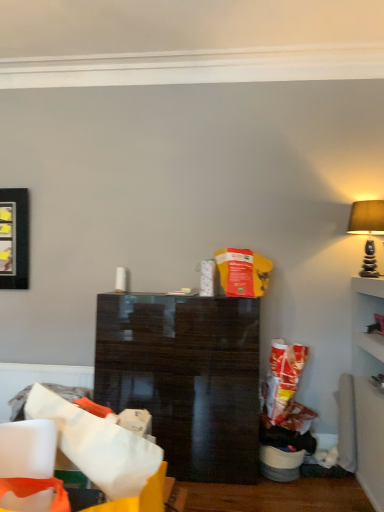
What is the approximate width of matte black picture frame at left?

matte black picture frame at left is 4.18 inches wide.

Measure the distance between matte black picture frame at left and camera.

The depth of matte black picture frame at left is 3.62 meters.

The image size is (384, 512). In order to click on glossy dark wood cabinet at center in this screenshot , I will do `click(185, 378)`.

The height and width of the screenshot is (512, 384). Find the location of `white paper bag at lower left`. white paper bag at lower left is located at coordinates (94, 442).

Is matte beige lampshade at upper right with matte black picture frame at left?

No, matte beige lampshade at upper right is not making contact with matte black picture frame at left.

Where is `picture frame behind the matte beige lampshade at upper right`? The image size is (384, 512). picture frame behind the matte beige lampshade at upper right is located at coordinates (14, 238).

Which is behind, matte beige lampshade at upper right or matte black picture frame at left?

matte black picture frame at left is further away from the camera.

Which is less distant, (153, 382) or (370, 209)?

Clearly, point (153, 382) is closer to the camera than point (370, 209).

Could you tell me if glossy dark wood cabinet at center is turned towards matte beige lampshade at upper right?

No, glossy dark wood cabinet at center is not aimed at matte beige lampshade at upper right.

The image size is (384, 512). In the image, there is a matte beige lampshade at upper right. In order to click on shelf below it (from the image's perspective) in this screenshot , I will do `click(185, 378)`.

Consider the image. Can you confirm if glossy dark wood cabinet at center is positioned to the right of matte beige lampshade at upper right?

In fact, glossy dark wood cabinet at center is to the left of matte beige lampshade at upper right.

Considering the relative positions of matte black picture frame at left and white paper bag at lower left in the image provided, is matte black picture frame at left to the left of white paper bag at lower left from the viewer's perspective?

Correct, you'll find matte black picture frame at left to the left of white paper bag at lower left.

Which of these two, matte black picture frame at left or white paper bag at lower left, stands taller?

matte black picture frame at left.

Who is smaller, matte black picture frame at left or white paper bag at lower left?

Smaller between the two is matte black picture frame at left.

Is matte black picture frame at left positioned beyond the bounds of white paper bag at lower left?

Yes.

Is white paper bag at lower left in front of or behind glossy dark wood cabinet at center in the image?

In the image, white paper bag at lower left appears in front of glossy dark wood cabinet at center.

Who is bigger, white paper bag at lower left or glossy dark wood cabinet at center?

With larger size is glossy dark wood cabinet at center.

Is white paper bag at lower left facing away from glossy dark wood cabinet at center?

No, white paper bag at lower left is not facing the opposite direction of glossy dark wood cabinet at center.

Is there a large distance between white paper bag at lower left and glossy dark wood cabinet at center?

That's right, there is a large distance between white paper bag at lower left and glossy dark wood cabinet at center.

Does white paper bag at lower left touch matte beige lampshade at upper right?

white paper bag at lower left and matte beige lampshade at upper right are clearly separated.

Between white paper bag at lower left and matte beige lampshade at upper right, which one has smaller size?

With smaller size is matte beige lampshade at upper right.

Where is `picture frame that is behind the glossy dark wood cabinet at center`? picture frame that is behind the glossy dark wood cabinet at center is located at coordinates (14, 238).

Is matte black picture frame at left situated inside glossy dark wood cabinet at center or outside?

matte black picture frame at left cannot be found inside glossy dark wood cabinet at center.

In the scene shown: Considering the positions of objects matte black picture frame at left and glossy dark wood cabinet at center in the image provided, who is more to the right, matte black picture frame at left or glossy dark wood cabinet at center?

From the viewer's perspective, glossy dark wood cabinet at center appears more on the right side.

Is matte black picture frame at left wider than glossy dark wood cabinet at center?

No, matte black picture frame at left is not wider than glossy dark wood cabinet at center.

Which is more to the right, matte beige lampshade at upper right or white paper bag at lower left?

From the viewer's perspective, matte beige lampshade at upper right appears more on the right side.

Is matte beige lampshade at upper right located outside white paper bag at lower left?

matte beige lampshade at upper right is positioned outside white paper bag at lower left.

Considering the relative sizes of matte beige lampshade at upper right and white paper bag at lower left in the image provided, is matte beige lampshade at upper right taller than white paper bag at lower left?

Correct, matte beige lampshade at upper right is much taller as white paper bag at lower left.

From the image's perspective, is matte beige lampshade at upper right beneath white paper bag at lower left?

Actually, matte beige lampshade at upper right appears above white paper bag at lower left in the image.

Locate an element on the screen. lamp that is below the matte black picture frame at left (from the image's perspective) is located at coordinates (367, 230).

I want to click on shelf that appears below the matte beige lampshade at upper right (from a real-world perspective), so click(185, 378).

Based on the photo, which object lies nearer to the anchor point matte beige lampshade at upper right, matte black picture frame at left or white paper bag at lower left?

white paper bag at lower left is closer to matte beige lampshade at upper right.

When comparing their distances from matte black picture frame at left, does white paper bag at lower left or glossy dark wood cabinet at center seem further?

white paper bag at lower left lies further to matte black picture frame at left than the other object.

Based on the photo, from the image, which object appears to be farther from glossy dark wood cabinet at center, matte black picture frame at left or white paper bag at lower left?

Based on the image, white paper bag at lower left appears to be further to glossy dark wood cabinet at center.

Based on their spatial positions, is glossy dark wood cabinet at center or white paper bag at lower left further from matte beige lampshade at upper right?

white paper bag at lower left is positioned further to the anchor matte beige lampshade at upper right.

Based on their spatial positions, is matte black picture frame at left or glossy dark wood cabinet at center closer to matte beige lampshade at upper right?

Among the two, glossy dark wood cabinet at center is located nearer to matte beige lampshade at upper right.

From the picture: Looking at the image, which one is located further to matte black picture frame at left, glossy dark wood cabinet at center or white paper bag at lower left?

Based on the image, white paper bag at lower left appears to be further to matte black picture frame at left.

Estimate the real-world distances between objects in this image. Which object is further from white paper bag at lower left, matte black picture frame at left or matte beige lampshade at upper right?

Among the two, matte black picture frame at left is located further to white paper bag at lower left.

Looking at the image, which one is located further to matte beige lampshade at upper right, white paper bag at lower left or matte black picture frame at left?

matte black picture frame at left.

Locate an element on the screen. shelf positioned between white paper bag at lower left and matte black picture frame at left from near to far is located at coordinates (185, 378).

The width and height of the screenshot is (384, 512). I want to click on shelf between white paper bag at lower left and matte beige lampshade at upper right along the z-axis, so click(x=185, y=378).

The height and width of the screenshot is (512, 384). In order to click on lamp between white paper bag at lower left and matte black picture frame at left from front to back in this screenshot , I will do `click(367, 230)`.

Locate an element on the screen. This screenshot has width=384, height=512. shelf located between matte black picture frame at left and matte beige lampshade at upper right in the left-right direction is located at coordinates (185, 378).